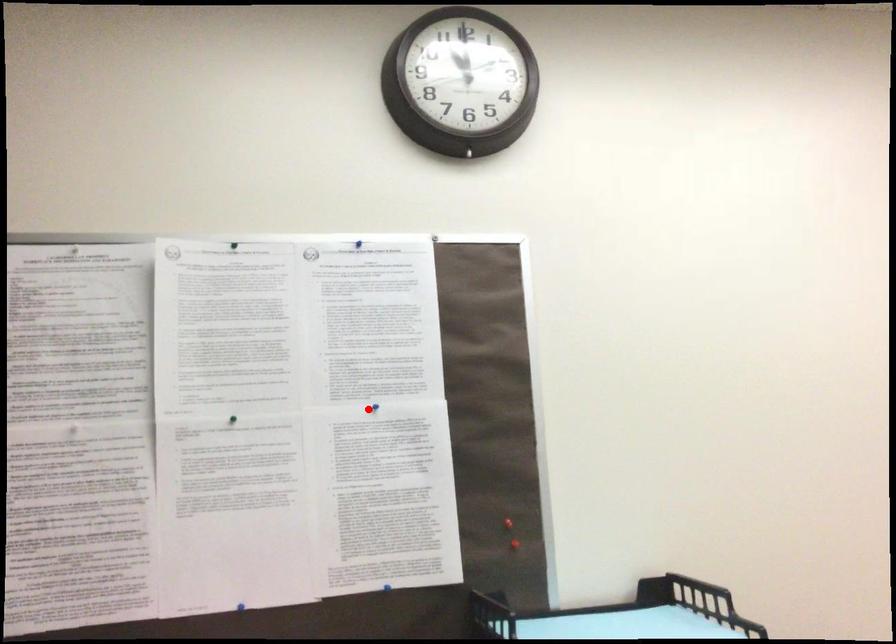
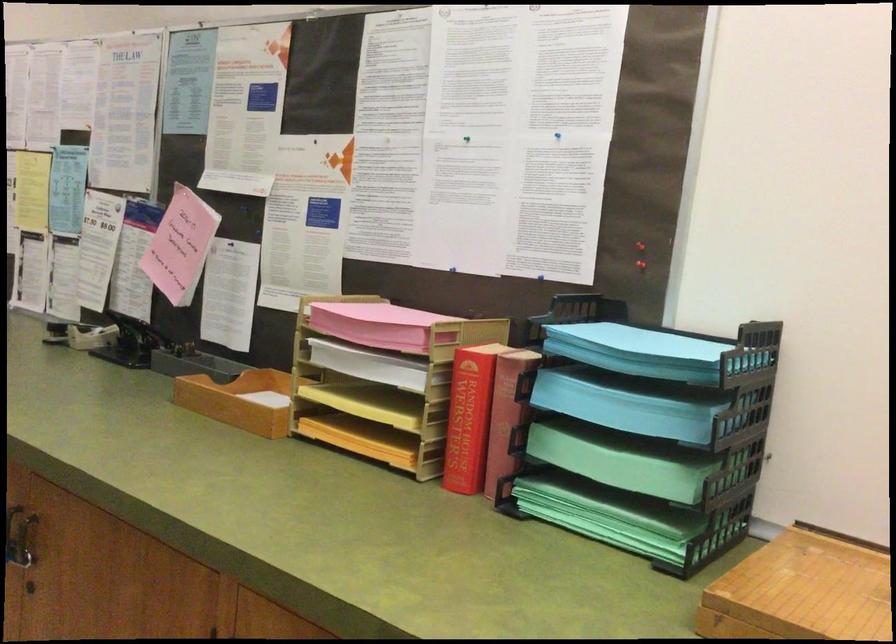
Question: I am providing you with two images of the same scene from different viewpoints. In image1, a red point is highlighted. Considering the same 3D point in image2, which of the following is correct?

Choices:
 (A) It is closer
 (B) It is farther

Answer: (B)